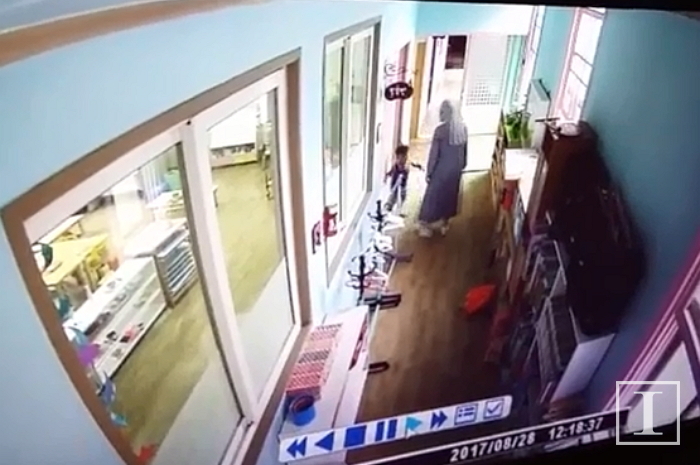
Find the location of a particular element. This screenshot has width=700, height=465. floor is located at coordinates (451, 354), (248, 256).